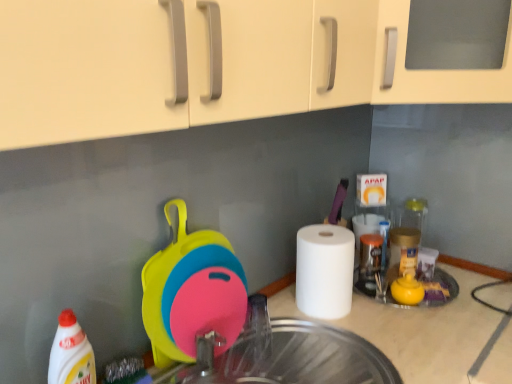
Where is `vacant area located to the right-hand side of metallic silver faucet at center`? The image size is (512, 384). vacant area located to the right-hand side of metallic silver faucet at center is located at coordinates (319, 348).